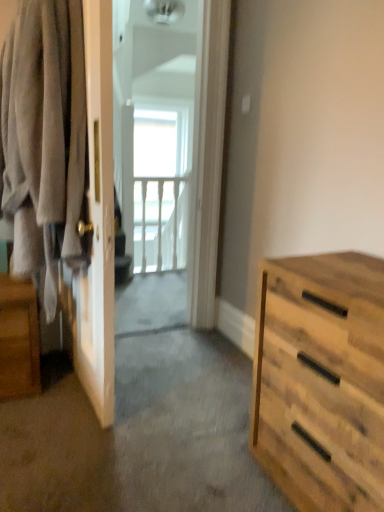
At what (x,y) coordinates should I click in order to perform the action: click on wooden nightstand at left. Please return your answer as a coordinate pair (x, y). Looking at the image, I should click on (18, 339).

Image resolution: width=384 pixels, height=512 pixels. What do you see at coordinates (321, 380) in the screenshot? I see `natural wood dresser at right` at bounding box center [321, 380].

Measure the distance between soft gray fabric at left and camera.

soft gray fabric at left is 4.56 feet from camera.

This screenshot has height=512, width=384. In order to click on white wooden balustrade at upper center in this screenshot , I will do `click(159, 223)`.

I want to click on white glossy screen door at center, so click(x=157, y=134).

Where is `wooden nightstand at left`? This screenshot has width=384, height=512. wooden nightstand at left is located at coordinates pyautogui.click(x=18, y=339).

Is point (166, 106) closer or farther from the camera than point (161, 232)?

Point (166, 106) is positioned farther from the camera compared to point (161, 232).

Can you tell me how much white glossy screen door at center and white wooden balustrade at upper center differ in facing direction?

The facing directions of white glossy screen door at center and white wooden balustrade at upper center are 1.7 degrees apart.

Who is more distant, white glossy screen door at center or white wooden balustrade at upper center?

white wooden balustrade at upper center is further from the camera.

From the image's perspective, which one is positioned lower, white glossy screen door at center or white wooden balustrade at upper center?

white wooden balustrade at upper center, from the image's perspective.

Which is in front, point (342, 340) or point (66, 149)?

The point (342, 340) is more forward.

Considering the sizes of natural wood dresser at right and soft gray fabric at left in the image, is natural wood dresser at right wider or thinner than soft gray fabric at left?

In the image, natural wood dresser at right appears to be wider than soft gray fabric at left.

Which object is positioned more to the right, natural wood dresser at right or soft gray fabric at left?

natural wood dresser at right is more to the right.

Between soft gray fabric at left and white wooden balustrade at upper center, which one has more height?

soft gray fabric at left is taller.

Does soft gray fabric at left appear on the right side of white wooden balustrade at upper center?

Incorrect, soft gray fabric at left is not on the right side of white wooden balustrade at upper center.

Does soft gray fabric at left come in front of white wooden balustrade at upper center?

Yes, soft gray fabric at left is closer to the camera.

I want to click on clothing in front of the white wooden balustrade at upper center, so (44, 135).

Are soft gray fabric at left and natural wood dresser at right far apart?

That's not correct — soft gray fabric at left is a little close to natural wood dresser at right.

Does soft gray fabric at left appear on the right side of natural wood dresser at right?

Incorrect, soft gray fabric at left is not on the right side of natural wood dresser at right.

From the image's perspective, which one is positioned lower, soft gray fabric at left or natural wood dresser at right?

From the image's view, natural wood dresser at right is below.

Is natural wood dresser at right surrounded by soft gray fabric at left?

No, natural wood dresser at right is not inside soft gray fabric at left.

From their relative heights in the image, would you say wooden nightstand at left is taller or shorter than white wooden balustrade at upper center?

Clearly, wooden nightstand at left is shorter compared to white wooden balustrade at upper center.

This screenshot has width=384, height=512. What are the coordinates of `nightstand below the white wooden balustrade at upper center (from the image's perspective)` in the screenshot? It's located at (18, 339).

Is wooden nightstand at left turned away from white wooden balustrade at upper center?

That's not correct — wooden nightstand at left is not looking away from white wooden balustrade at upper center.

Which object is closer to the camera, wooden nightstand at left or white wooden balustrade at upper center?

wooden nightstand at left is closer to the camera.

Which of these two, soft gray fabric at left or wooden nightstand at left, is wider?

wooden nightstand at left.

At what (x,y) coordinates should I click in order to perform the action: click on clothing above the wooden nightstand at left (from the image's perspective). Please return your answer as a coordinate pair (x, y). The image size is (384, 512). Looking at the image, I should click on (44, 135).

Is soft gray fabric at left facing away from wooden nightstand at left?

No.

Between soft gray fabric at left and wooden nightstand at left, which one has more height?

soft gray fabric at left.

Looking at this image, from a real-world perspective, is natural wood dresser at right positioned under white glossy screen door at center based on gravity?

Yes.

Considering the positions of point (317, 506) and point (189, 161), is point (317, 506) closer or farther from the camera than point (189, 161)?

Point (317, 506) is positioned closer to the camera compared to point (189, 161).

Does natural wood dresser at right appear on the right side of white glossy screen door at center?

Yes, natural wood dresser at right is to the right of white glossy screen door at center.

Looking at their sizes, would you say natural wood dresser at right is wider or thinner than white glossy screen door at center?

Clearly, natural wood dresser at right has more width compared to white glossy screen door at center.

In order to click on balustrade that is below the white glossy screen door at center (from the image's perspective) in this screenshot , I will do `click(159, 223)`.

Where is `clothing behind the natural wood dresser at right`? The width and height of the screenshot is (384, 512). clothing behind the natural wood dresser at right is located at coordinates (44, 135).

Looking at the image, which one is located further to soft gray fabric at left, white glossy screen door at center or natural wood dresser at right?

white glossy screen door at center.

Considering their positions, is soft gray fabric at left positioned closer to white wooden balustrade at upper center than natural wood dresser at right?

Among the two, soft gray fabric at left is located nearer to white wooden balustrade at upper center.

When comparing their distances from natural wood dresser at right, does white glossy screen door at center or soft gray fabric at left seem closer?

soft gray fabric at left lies closer to natural wood dresser at right than the other object.

From the image, which object appears to be farther from natural wood dresser at right, white wooden balustrade at upper center or wooden nightstand at left?

Result: Among the two, white wooden balustrade at upper center is located further to natural wood dresser at right.

When comparing their distances from soft gray fabric at left, does white wooden balustrade at upper center or wooden nightstand at left seem further?

white wooden balustrade at upper center is further to soft gray fabric at left.

Based on their spatial positions, is natural wood dresser at right or white wooden balustrade at upper center further from soft gray fabric at left?

white wooden balustrade at upper center lies further to soft gray fabric at left than the other object.

When comparing their distances from natural wood dresser at right, does wooden nightstand at left or soft gray fabric at left seem closer?

Among the two, soft gray fabric at left is located nearer to natural wood dresser at right.

Consider the image. Estimate the real-world distances between objects in this image. Which object is further from natural wood dresser at right, soft gray fabric at left or white wooden balustrade at upper center?

The object further to natural wood dresser at right is white wooden balustrade at upper center.

Locate an element on the screen. Image resolution: width=384 pixels, height=512 pixels. screen door positioned between soft gray fabric at left and white wooden balustrade at upper center from near to far is located at coordinates (157, 134).

At what (x,y) coordinates should I click in order to perform the action: click on screen door located between soft gray fabric at left and natural wood dresser at right in the left-right direction. Please return your answer as a coordinate pair (x, y). This screenshot has height=512, width=384. Looking at the image, I should click on (157, 134).

Identify the location of clothing between white glossy screen door at center and wooden nightstand at left in the vertical direction. The width and height of the screenshot is (384, 512). (44, 135).

Identify the location of screen door between wooden nightstand at left and natural wood dresser at right from left to right. This screenshot has width=384, height=512. (157, 134).